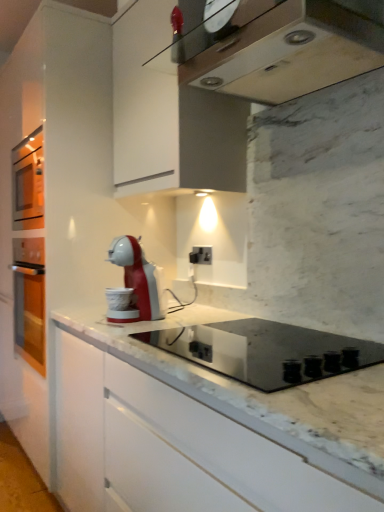
Question: Is metallic silver range hood at upper center wider or thinner than black plastic electric outlet at center?

Choices:
 (A) thin
 (B) wide

Answer: (B)

Question: Choose the correct answer: Is metallic silver range hood at upper center inside black plastic electric outlet at center or outside it?

Choices:
 (A) inside
 (B) outside

Answer: (B)

Question: Based on their relative distances, which object is farther from the black plastic electric outlet at center?

Choices:
 (A) metallic silver range hood at upper center
 (B) black glass cooktop at center

Answer: (A)

Question: Which object is positioned farthest from the black glass cooktop at center?

Choices:
 (A) metallic silver range hood at upper center
 (B) black plastic electric outlet at center

Answer: (A)